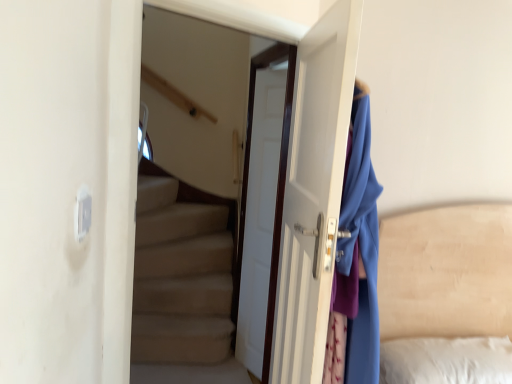
Question: Which direction should I rotate to face white glossy door at center, the second door positioned from the back, — up or down?

Choices:
 (A) down
 (B) up

Answer: (A)

Question: Is white glossy door at center, the second door positioned from the back, far away from white glossy door at center, acting as the second door starting from the front?

Choices:
 (A) no
 (B) yes

Answer: (A)

Question: Is white glossy door at center, placed as the first door when sorted from front to back, taller than white glossy door at center, acting as the second door starting from the front?

Choices:
 (A) yes
 (B) no

Answer: (B)

Question: Is white glossy door at center, placed as the first door when sorted from front to back, to the right of white glossy door at center, acting as the second door starting from the front, from the viewer's perspective?

Choices:
 (A) yes
 (B) no

Answer: (A)

Question: Considering the relative sizes of white glossy door at center, the second door positioned from the back, and white glossy door at center, which is counted as the 1th door, starting from the back, in the image provided, is white glossy door at center, the second door positioned from the back, wider than white glossy door at center, which is counted as the 1th door, starting from the back,?

Choices:
 (A) yes
 (B) no

Answer: (A)

Question: Does white glossy door at center, the second door positioned from the back, have a smaller size compared to white glossy door at center, acting as the second door starting from the front?

Choices:
 (A) no
 (B) yes

Answer: (B)

Question: Is white glossy door at center, placed as the first door when sorted from front to back, with white glossy door at center, acting as the second door starting from the front?

Choices:
 (A) no
 (B) yes

Answer: (A)

Question: Is white glossy door at center, which is counted as the 1th door, starting from the back, at the left side of white glossy door at center, placed as the first door when sorted from front to back?

Choices:
 (A) yes
 (B) no

Answer: (A)

Question: From a real-world perspective, is white glossy door at center, acting as the second door starting from the front, beneath white glossy door at center, placed as the first door when sorted from front to back?

Choices:
 (A) no
 (B) yes

Answer: (B)

Question: Is white glossy door at center, acting as the second door starting from the front, at the right side of white glossy door at center, the second door positioned from the back?

Choices:
 (A) yes
 (B) no

Answer: (B)

Question: Can you confirm if white glossy door at center, acting as the second door starting from the front, is wider than white glossy door at center, placed as the first door when sorted from front to back?

Choices:
 (A) yes
 (B) no

Answer: (B)

Question: Would you say white glossy door at center, acting as the second door starting from the front, is outside white glossy door at center, the second door positioned from the back?

Choices:
 (A) no
 (B) yes

Answer: (B)

Question: Is white glossy door at center, which is counted as the 1th door, starting from the back, far from white glossy door at center, placed as the first door when sorted from front to back?

Choices:
 (A) no
 (B) yes

Answer: (A)

Question: Is point (276, 82) positioned closer to the camera than point (327, 223)?

Choices:
 (A) closer
 (B) farther

Answer: (B)